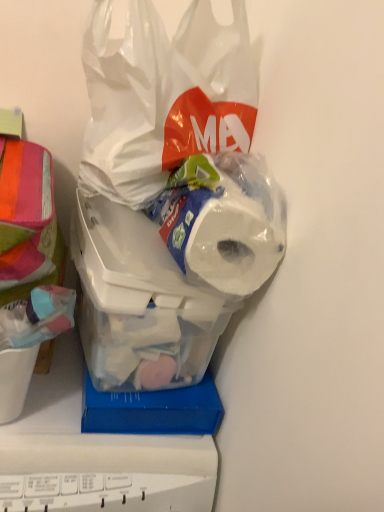
The width and height of the screenshot is (384, 512). In order to click on transparent plastic bag at upper center in this screenshot , I will do `click(163, 97)`.

Describe the element at coordinates (223, 221) in the screenshot. This screenshot has height=512, width=384. I see `white matte toilet paper at center` at that location.

I want to click on transparent plastic bag at upper center, so click(163, 97).

Locate an element on the screen. plastic bag to the left of white matte toilet paper at center is located at coordinates click(163, 97).

From a real-world perspective, is white matte toilet paper at center on transparent plastic bag at upper center?

No, from a real-world perspective, white matte toilet paper at center is not above transparent plastic bag at upper center.

Looking at this image, is white matte toilet paper at center to the right of transparent plastic bag at upper center from the viewer's perspective?

Indeed, white matte toilet paper at center is positioned on the right side of transparent plastic bag at upper center.

From a real-world perspective, is multicolored fabric at left under white matte toilet paper at center?

Yes, from a real-world perspective, multicolored fabric at left is under white matte toilet paper at center.

Between multicolored fabric at left and white matte toilet paper at center, which one has larger size?

multicolored fabric at left.

Is multicolored fabric at left facing towards white matte toilet paper at center?

No, multicolored fabric at left is not turned towards white matte toilet paper at center.

How different are the orientations of multicolored fabric at left and white matte toilet paper at center in degrees?

They differ by 0.000696 degrees in their facing directions.

Which is correct: white matte toilet paper at center is inside multicolored fabric at left, or outside of it?

white matte toilet paper at center lies outside multicolored fabric at left.

Which object is wider, white matte toilet paper at center or multicolored fabric at left?

Wider between the two is multicolored fabric at left.

This screenshot has height=512, width=384. There is a multicolored fabric at left. In order to click on toilet paper above it (from a real-world perspective) in this screenshot , I will do `click(223, 221)`.

Is white matte toilet paper at center thinner than translucent plastic container at center?

Yes.

Which is in front, white matte toilet paper at center or translucent plastic container at center?

white matte toilet paper at center is in front.

Is white matte toilet paper at center aimed at translucent plastic container at center?

No, white matte toilet paper at center does not turn towards translucent plastic container at center.

Can you confirm if transparent plastic bag at upper center is wider than white matte toilet paper at center?

Correct, the width of transparent plastic bag at upper center exceeds that of white matte toilet paper at center.

Would you say transparent plastic bag at upper center contains white matte toilet paper at center?

No, white matte toilet paper at center is not inside transparent plastic bag at upper center.

Is transparent plastic bag at upper center at the right side of white matte toilet paper at center?

No, transparent plastic bag at upper center is not to the right of white matte toilet paper at center.

What's the angular difference between transparent plastic bag at upper center and white matte toilet paper at center's facing directions?

The angle between the facing direction of transparent plastic bag at upper center and the facing direction of white matte toilet paper at center is 0.00017 degrees.

Considering the sizes of objects translucent plastic container at center and multicolored fabric at left in the image provided, who is smaller, translucent plastic container at center or multicolored fabric at left?

multicolored fabric at left.

Is translucent plastic container at center not inside multicolored fabric at left?

Indeed, translucent plastic container at center is completely outside multicolored fabric at left.

Which is farther from the camera, [142,370] or [7,172]?

The point [7,172] is farther.

Between multicolored fabric at left and transparent plastic bag at upper center, which one has less height?

multicolored fabric at left.

I want to click on plastic bag that is behind the multicolored fabric at left, so click(x=163, y=97).

Is multicolored fabric at left not close to transparent plastic bag at upper center?

No, multicolored fabric at left is not far from transparent plastic bag at upper center.

Is multicolored fabric at left closer to camera compared to transparent plastic bag at upper center?

Yes, it is in front of transparent plastic bag at upper center.

Locate an element on the screen. toilet paper located below the transparent plastic bag at upper center (from the image's perspective) is located at coordinates (223, 221).

The width and height of the screenshot is (384, 512). Identify the location of wrapping paper on the left of white matte toilet paper at center. (26, 214).

Looking at the image, which one is located further to multicolored fabric at left, translucent plastic container at center or transparent plastic bag at upper center?

The object further to multicolored fabric at left is transparent plastic bag at upper center.

Considering their positions, is translucent plastic container at center positioned further to transparent plastic bag at upper center than multicolored fabric at left?

Based on the image, multicolored fabric at left appears to be further to transparent plastic bag at upper center.

Which object lies nearer to the anchor point white matte toilet paper at center, translucent plastic container at center or transparent plastic bag at upper center?

translucent plastic container at center is positioned closer to the anchor white matte toilet paper at center.

From the image, which object appears to be nearer to white matte toilet paper at center, multicolored fabric at left or translucent plastic container at center?

Based on the image, translucent plastic container at center appears to be nearer to white matte toilet paper at center.

From the image, which object appears to be farther from translucent plastic container at center, transparent plastic bag at upper center or white matte toilet paper at center?

transparent plastic bag at upper center lies further to translucent plastic container at center than the other object.

From the image, which object appears to be nearer to multicolored fabric at left, white matte toilet paper at center or translucent plastic container at center?

translucent plastic container at center.

When comparing their distances from transparent plastic bag at upper center, does white matte toilet paper at center or translucent plastic container at center seem further?

Among the two, translucent plastic container at center is located further to transparent plastic bag at upper center.

When comparing their distances from multicolored fabric at left, does transparent plastic bag at upper center or translucent plastic container at center seem closer?

Based on the image, translucent plastic container at center appears to be nearer to multicolored fabric at left.

In order to click on wrapping paper between transparent plastic bag at upper center and translucent plastic container at center vertically in this screenshot , I will do `click(26, 214)`.

This screenshot has height=512, width=384. Find the location of `plastic bag situated between multicolored fabric at left and white matte toilet paper at center from left to right`. plastic bag situated between multicolored fabric at left and white matte toilet paper at center from left to right is located at coordinates (163, 97).

Locate an element on the screen. This screenshot has height=512, width=384. wide between multicolored fabric at left and white matte toilet paper at center in the horizontal direction is located at coordinates (138, 302).

Find the location of a particular element. toilet paper between transparent plastic bag at upper center and translucent plastic container at center in the up-down direction is located at coordinates (223, 221).